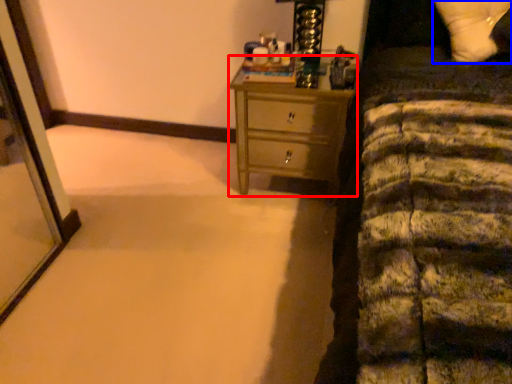
Question: Which point is closer to the camera, chest of drawers (highlighted by a red box) or pillow (highlighted by a blue box)?

Choices:
 (A) chest of drawers
 (B) pillow

Answer: (B)